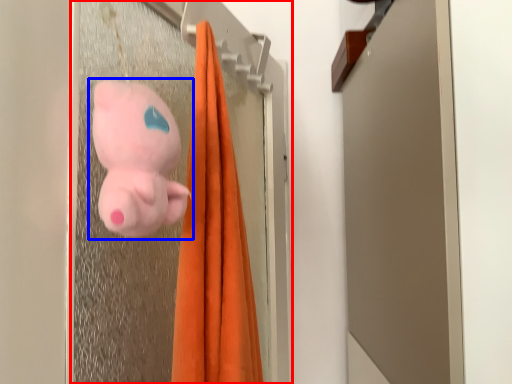
Question: Which object appears farthest to the camera in this image, screen door (highlighted by a red box) or toy (highlighted by a blue box)?

Choices:
 (A) screen door
 (B) toy

Answer: (B)